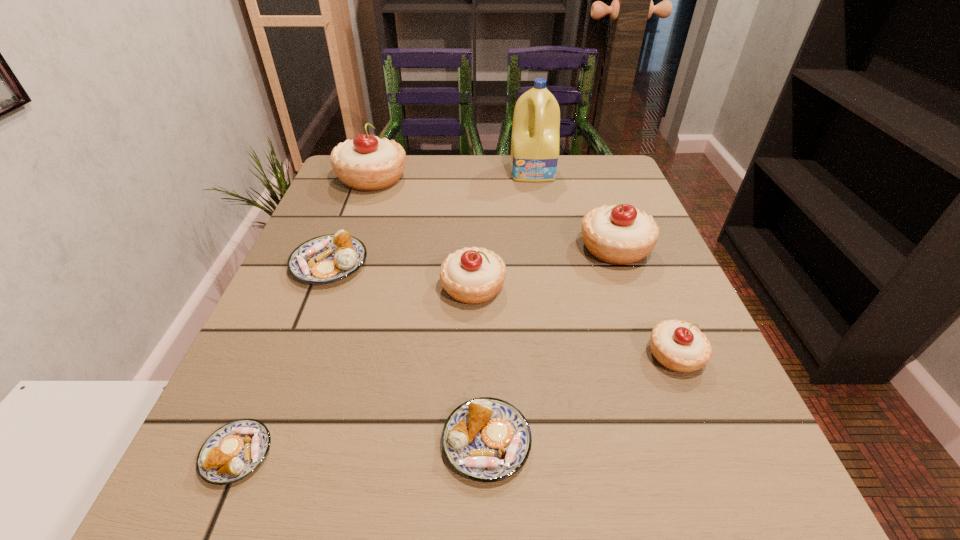
Image resolution: width=960 pixels, height=540 pixels. In order to click on vacant area that lies between the third object from right to left and the farthest brown pastry in this screenshot , I will do `click(432, 218)`.

Locate an element on the screen. This screenshot has width=960, height=540. free spot between the shortest object and the fifth shortest pastry is located at coordinates (355, 370).

At what (x,y) coordinates should I click in order to perform the action: click on free space between the biggest brown pastry and the sixth tallest pastry. Please return your answer as a coordinate pair (x, y). Looking at the image, I should click on (408, 353).

Find the location of a particular element. The image size is (960, 540). the sixth closest object to the sixth shortest object is located at coordinates (328, 258).

This screenshot has width=960, height=540. I want to click on object that is the closest to the smallest brown pastry, so click(486, 439).

Point out which pastry is positioned as the fifth nearest to the biggest beige pastry. Please provide its 2D coordinates. Your answer should be formatted as a tuple, i.e. [(x, y)], where the tuple contains the x and y coordinates of a point satisfying the conditions above.

[(232, 452)]

Where is `pastry that is the third closest to the smallest beige pastry`? The width and height of the screenshot is (960, 540). pastry that is the third closest to the smallest beige pastry is located at coordinates (473, 275).

Image resolution: width=960 pixels, height=540 pixels. In order to click on the closest beige pastry to the third biggest beige pastry in this screenshot , I will do `click(621, 234)`.

Locate which beige pastry ranks third in proximity to the fourth shortest pastry. Please provide its 2D coordinates. Your answer should be formatted as a tuple, i.e. [(x, y)], where the tuple contains the x and y coordinates of a point satisfying the conditions above.

[(367, 163)]

The width and height of the screenshot is (960, 540). What are the coordinates of `brown pastry that is the closest one to the tallest pastry` in the screenshot? It's located at (328, 258).